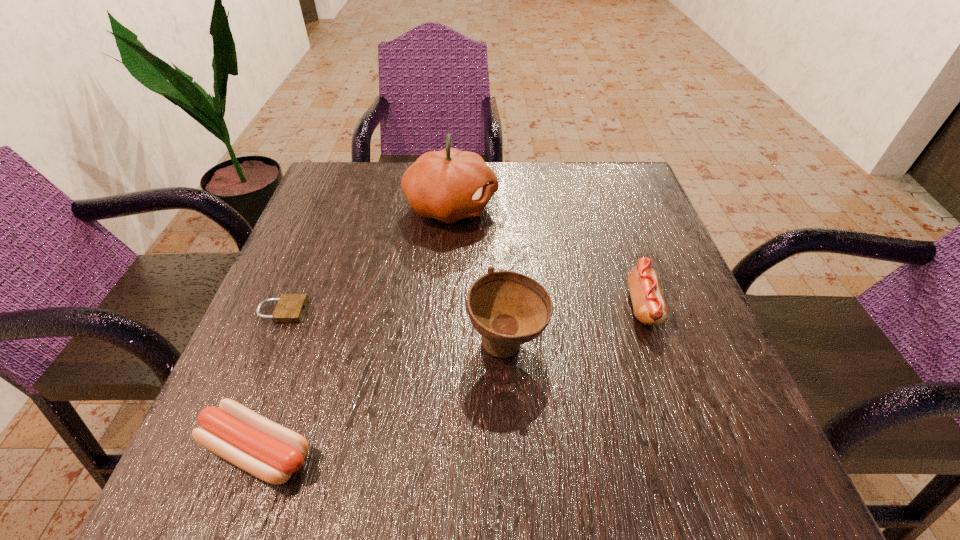
The image size is (960, 540). What are the coordinates of `vacant space situated on the left of the right sausage` in the screenshot? It's located at (492, 305).

Where is `vacant point located 0.060m on the back of the nearest object`? This screenshot has width=960, height=540. vacant point located 0.060m on the back of the nearest object is located at coordinates (284, 378).

This screenshot has width=960, height=540. Find the location of `free location located on the keyhole side of the shortest object`. free location located on the keyhole side of the shortest object is located at coordinates (436, 311).

You are a GUI agent. You are given a task and a screenshot of the screen. Output one action in this format:
    pyautogui.click(x=<x>, y=<y>)
    Task: Click on the object present at the far edge
    The height and width of the screenshot is (540, 960).
    Given the screenshot: What is the action you would take?
    pyautogui.click(x=449, y=185)

At what (x,y) coordinates should I click in order to perform the action: click on object situated at the near edge. Please return your answer as a coordinate pair (x, y). The height and width of the screenshot is (540, 960). Looking at the image, I should click on (259, 446).

Where is `sausage present at the left edge`? The width and height of the screenshot is (960, 540). sausage present at the left edge is located at coordinates (259, 446).

In order to click on padlock at the left edge in this screenshot , I will do `click(290, 308)`.

Locate an element on the screen. The image size is (960, 540). object that is at the right edge is located at coordinates (649, 306).

The height and width of the screenshot is (540, 960). What are the coordinates of `object at the near left corner` in the screenshot? It's located at (259, 446).

This screenshot has height=540, width=960. In the image, there is a desktop. Find the location of `vacant space at the far edge`. vacant space at the far edge is located at coordinates (392, 217).